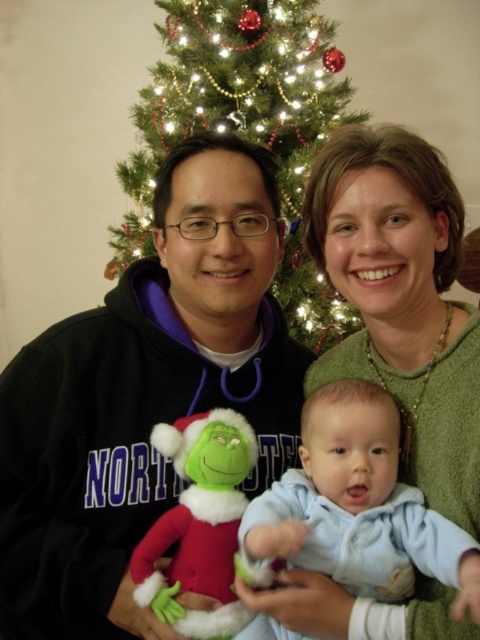
Question: Observing the image, what is the correct spatial positioning of light blue fleece baby at center in reference to velvety plush toy at center?

Choices:
 (A) below
 (B) above

Answer: (B)

Question: Is green knit sweater at upper right bigger than light blue fleece baby at center?

Choices:
 (A) no
 (B) yes

Answer: (B)

Question: Which object is positioned farthest from the light blue fleece baby at center?

Choices:
 (A) velvety plush toy at center
 (B) green matte christmas tree at upper center

Answer: (B)

Question: Is black fleece sweatshirt at left thinner than green matte christmas tree at upper center?

Choices:
 (A) no
 (B) yes

Answer: (B)

Question: Which point is farther to the camera?

Choices:
 (A) green knit sweater at upper right
 (B) light blue fleece baby at center
 (C) black fleece sweatshirt at left

Answer: (C)

Question: Which of these objects is positioned closest to the green knit sweater at upper right?

Choices:
 (A) velvety plush toy at center
 (B) black fleece sweatshirt at left
 (C) light blue fleece baby at center

Answer: (C)